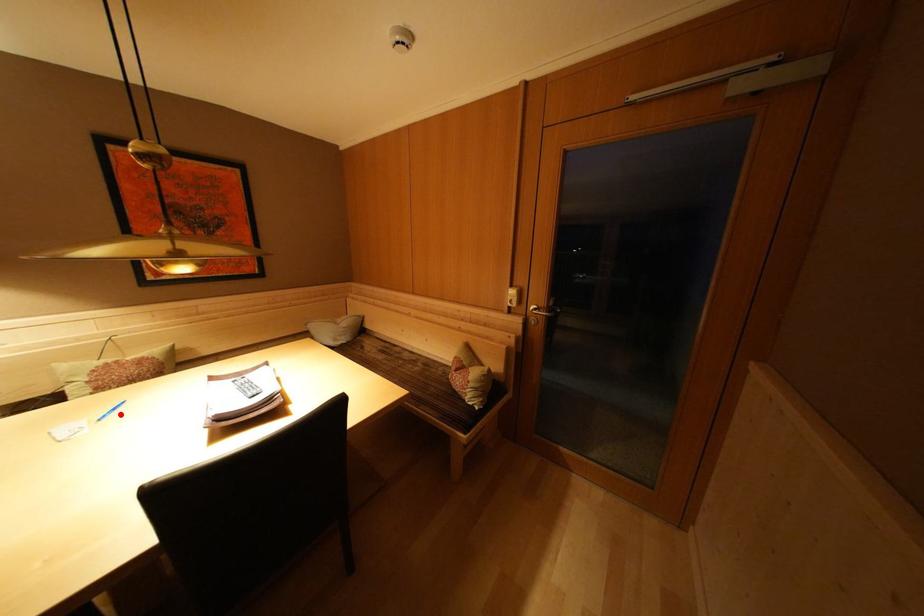
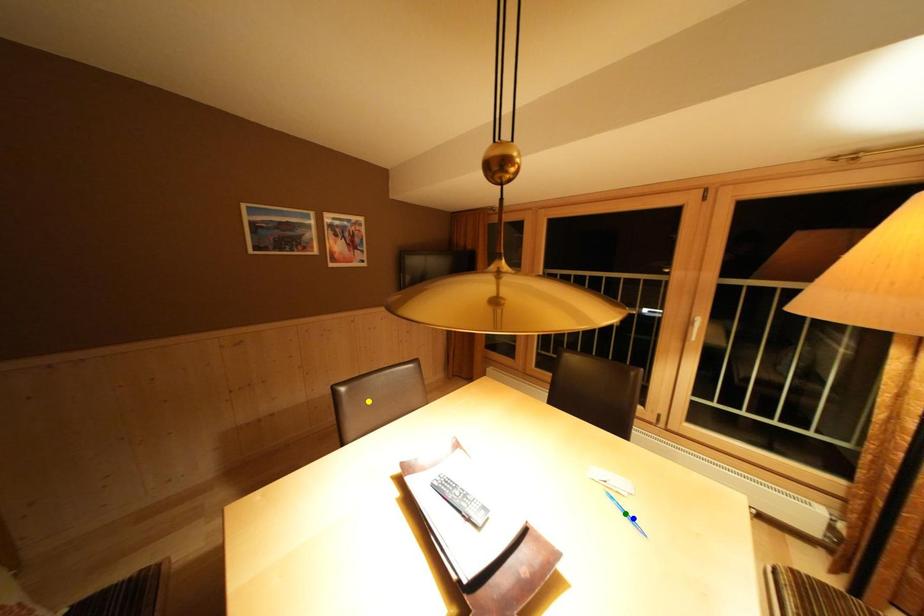
Question: I am providing you with two images of the same scene from different viewpoints. A red point is marked on the first image. You are given multiple points on the second image. Which point in image 2 represents the same 3d spot as the red point in image 1?

Choices:
 (A) blue point
 (B) green point
 (C) yellow point

Answer: (A)